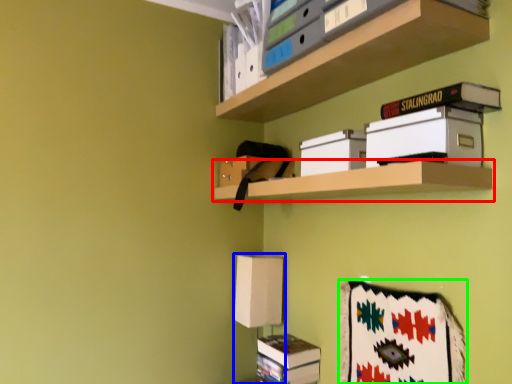
Question: Which object is the closest to the shelf (highlighted by a red box)? Choose among these: table lamp (highlighted by a blue box) or blanket (highlighted by a green box).

Choices:
 (A) table lamp
 (B) blanket

Answer: (B)